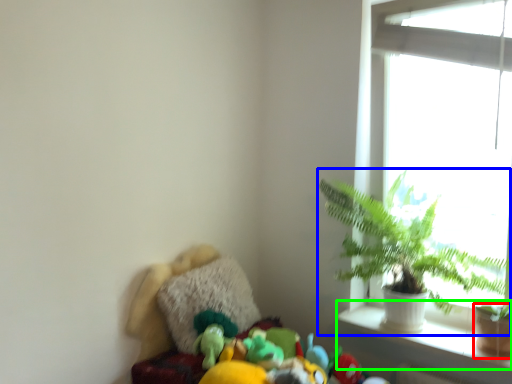
Question: Which object is positioned farthest from flowerpot (highlighted by a red box)? Select from houseplant (highlighted by a blue box) and window sill (highlighted by a green box).

Choices:
 (A) houseplant
 (B) window sill

Answer: (A)